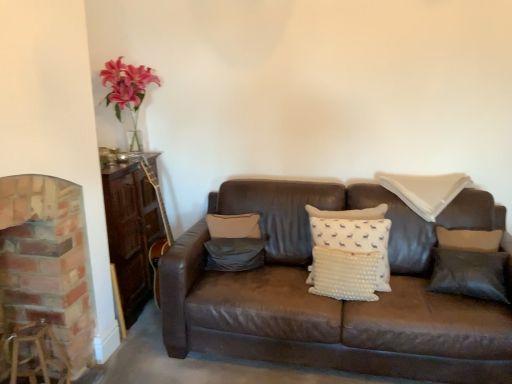
Question: Is white dotted pillow at upper right, acting as the 2th pillow starting from the right, smaller than black leather pillow at right, arranged as the fourth pillow when viewed from the left?

Choices:
 (A) yes
 (B) no

Answer: (B)

Question: Does white dotted pillow at upper right, the 3th pillow from the left, turn towards black leather pillow at right, arranged as the first pillow when viewed from the right?

Choices:
 (A) no
 (B) yes

Answer: (A)

Question: Can you confirm if white dotted pillow at upper right, the 3th pillow from the left, is thinner than black leather pillow at right, arranged as the fourth pillow when viewed from the left?

Choices:
 (A) yes
 (B) no

Answer: (B)

Question: Is white dotted pillow at upper right, acting as the 2th pillow starting from the right, to the right of black leather pillow at right, arranged as the fourth pillow when viewed from the left, from the viewer's perspective?

Choices:
 (A) no
 (B) yes

Answer: (A)

Question: Can you confirm if white dotted pillow at upper right, the 3th pillow from the left, is wider than black leather pillow at right, arranged as the fourth pillow when viewed from the left?

Choices:
 (A) yes
 (B) no

Answer: (A)

Question: Considering the relative sizes of white dotted pillow at upper right, acting as the 2th pillow starting from the right, and black leather pillow at right, arranged as the fourth pillow when viewed from the left, in the image provided, is white dotted pillow at upper right, acting as the 2th pillow starting from the right, taller than black leather pillow at right, arranged as the fourth pillow when viewed from the left,?

Choices:
 (A) yes
 (B) no

Answer: (B)

Question: Is white dotted pillow at upper right, the 3th pillow from the left, smaller than white dotted pillow at center, which is the second pillow in left-to-right order?

Choices:
 (A) yes
 (B) no

Answer: (B)

Question: Is white dotted pillow at upper right, the 3th pillow from the left, turned away from white dotted pillow at center, the 3th pillow in the right-to-left sequence?

Choices:
 (A) no
 (B) yes

Answer: (A)

Question: Can you confirm if white dotted pillow at upper right, acting as the 2th pillow starting from the right, is bigger than white dotted pillow at center, which is the second pillow in left-to-right order?

Choices:
 (A) yes
 (B) no

Answer: (A)

Question: From a real-world perspective, is white dotted pillow at upper right, acting as the 2th pillow starting from the right, below white dotted pillow at center, the 3th pillow in the right-to-left sequence?

Choices:
 (A) yes
 (B) no

Answer: (B)

Question: Is white dotted pillow at upper right, the 3th pillow from the left, directly adjacent to white dotted pillow at center, the 3th pillow in the right-to-left sequence?

Choices:
 (A) no
 (B) yes

Answer: (A)

Question: Is white dotted pillow at upper right, acting as the 2th pillow starting from the right, completely or partially outside of white dotted pillow at center, the 3th pillow in the right-to-left sequence?

Choices:
 (A) yes
 (B) no

Answer: (A)

Question: From a real-world perspective, is brick fireplace at left positioned under white dotted pillow at upper right, the 3th pillow from the left, based on gravity?

Choices:
 (A) no
 (B) yes

Answer: (B)